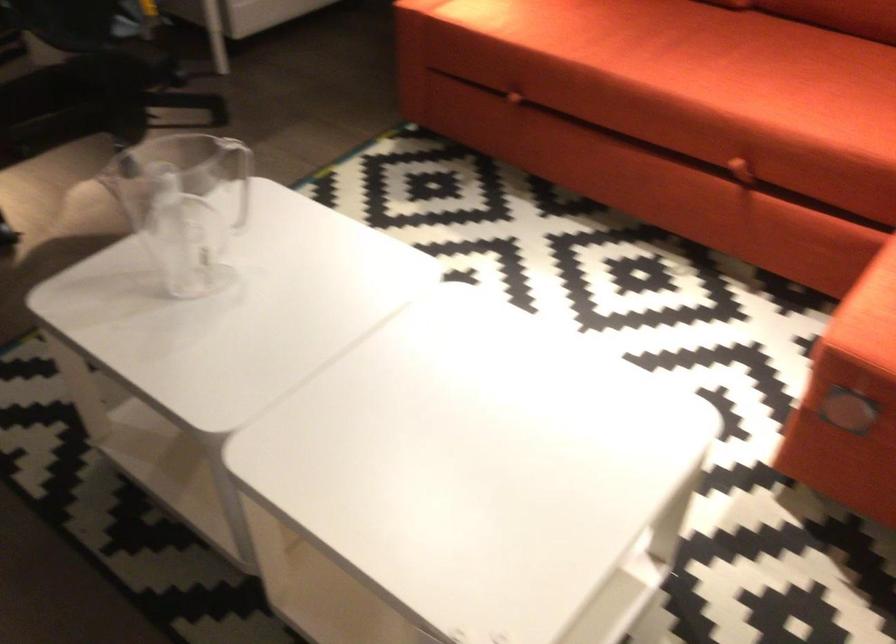
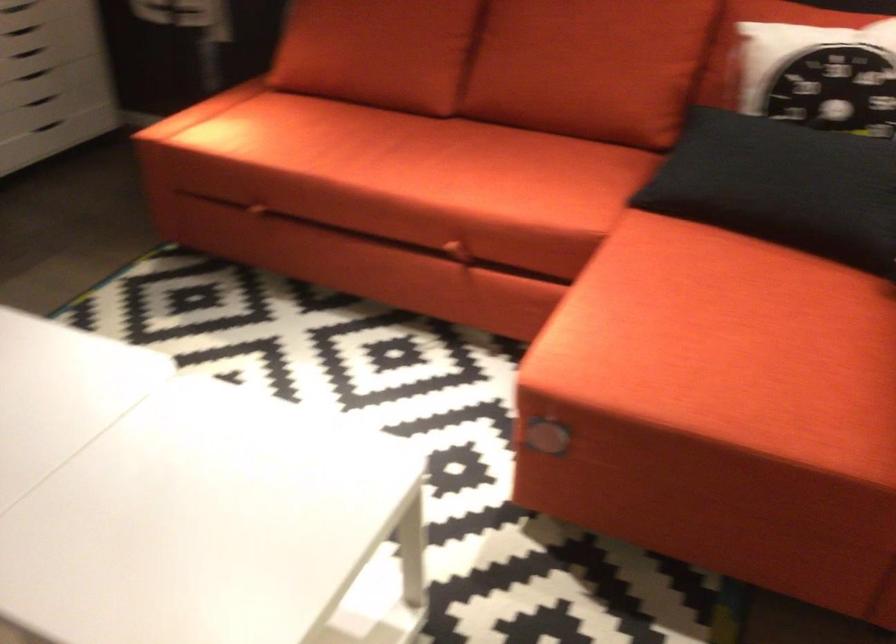
Question: The camera is either moving clockwise (left) or counter-clockwise (right) around the object. The first image is from the beginning of the video and the second image is from the end. Is the camera moving left or right when shooting the video?

Choices:
 (A) Left
 (B) Right

Answer: (A)